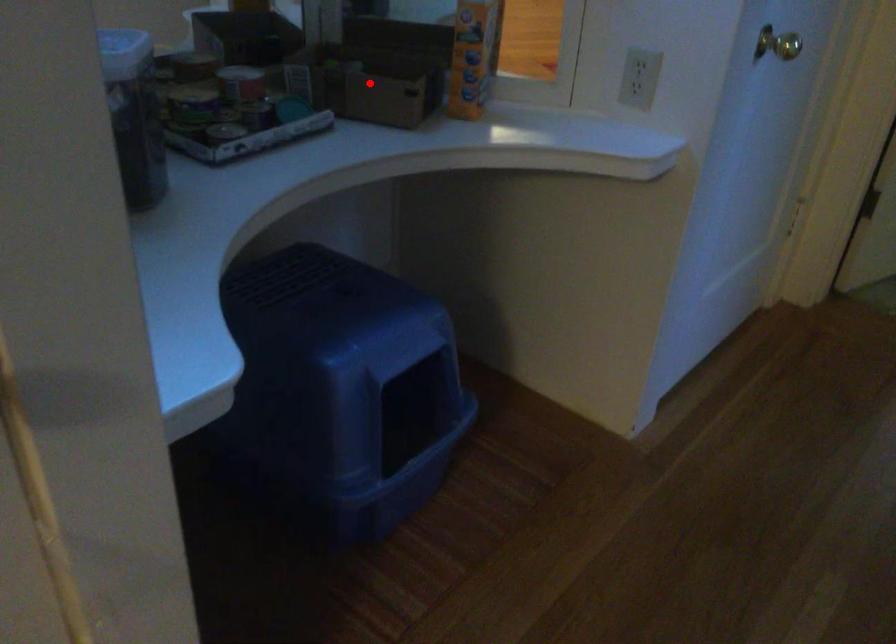
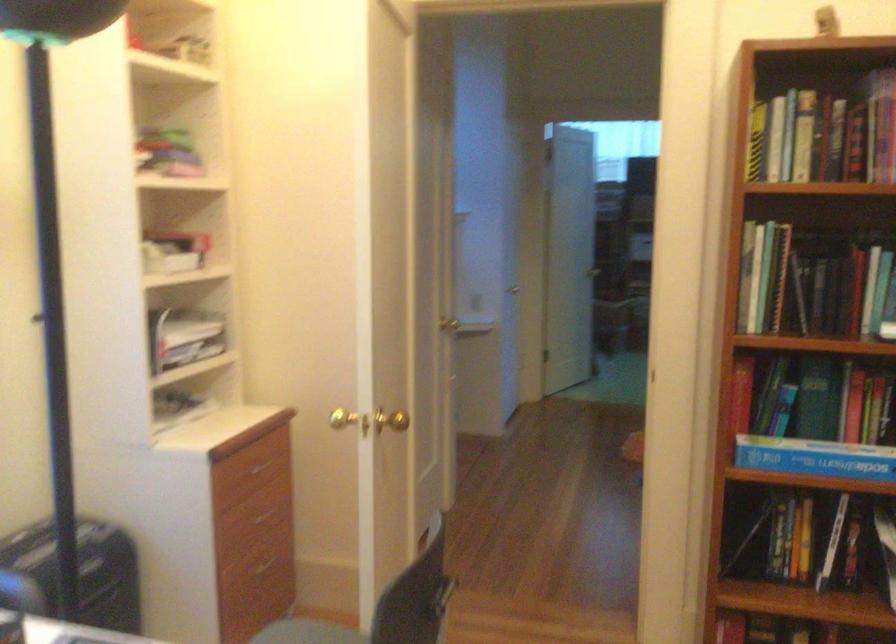
Question: I am providing you with two images of the same scene from different viewpoints. A red point is marked on the first image. Is the red point's position out of view in image 2?

Choices:
 (A) Yes
 (B) No

Answer: (A)